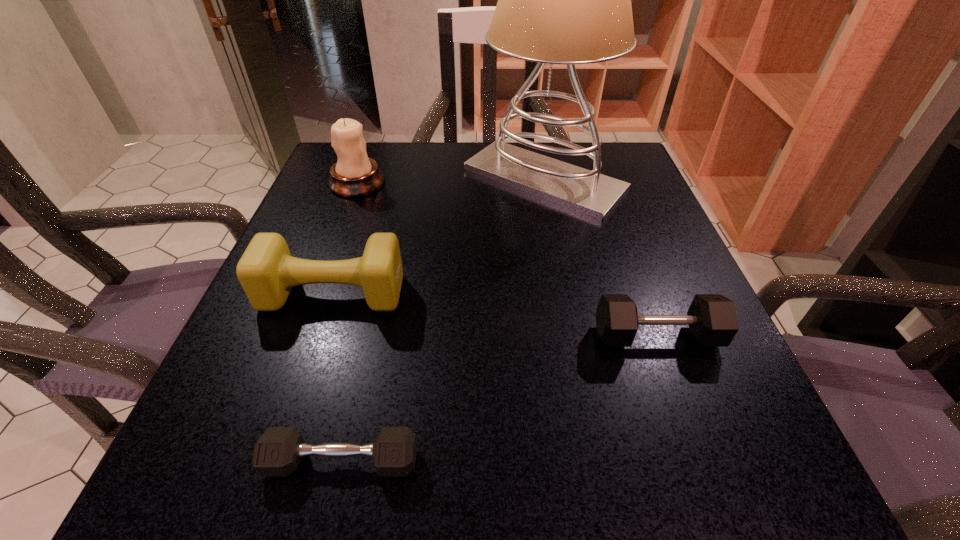
The image size is (960, 540). Identify the location of vacant space situated on the front of the tallest dumbbell. (306, 373).

Where is `vacant area located on the back of the rightmost dumbbell`? The height and width of the screenshot is (540, 960). vacant area located on the back of the rightmost dumbbell is located at coordinates (613, 218).

Where is `vacant space located 0.140m on the right of the shortest object`? This screenshot has width=960, height=540. vacant space located 0.140m on the right of the shortest object is located at coordinates (532, 461).

The width and height of the screenshot is (960, 540). I want to click on table lamp located at the far edge, so click(x=566, y=0).

You are a GUI agent. You are given a task and a screenshot of the screen. Output one action in this format:
    pyautogui.click(x=<x>, y=<y>)
    Task: Click on the candle holder that is at the far edge
    
    Given the screenshot: What is the action you would take?
    pyautogui.click(x=354, y=174)

Where is `object present at the near edge`? object present at the near edge is located at coordinates (278, 452).

The height and width of the screenshot is (540, 960). Identify the location of candle holder located at the left edge. (354, 174).

Image resolution: width=960 pixels, height=540 pixels. Find the location of `table lamp that is positioned at the right edge`. table lamp that is positioned at the right edge is located at coordinates (566, 0).

Image resolution: width=960 pixels, height=540 pixels. Identify the location of dumbbell that is positioned at the right edge. (712, 320).

This screenshot has height=540, width=960. I want to click on object that is at the far left corner, so click(x=354, y=174).